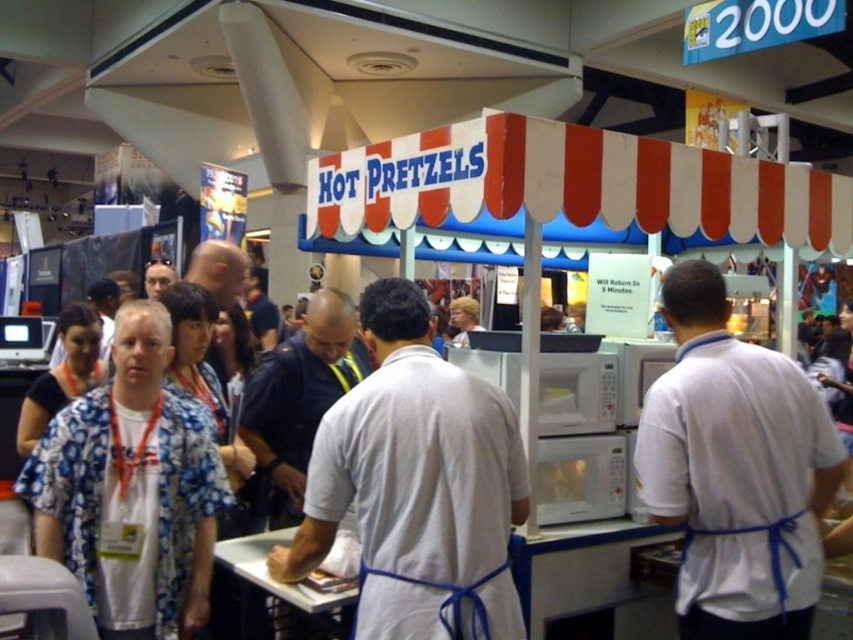
You are a visitor at the convention and want to ask the staff about the pretzel flavors. Which staff member should you approach, the one wearing the white matte shirt at center or the dark blue uniform at center, based on their position relative to each other?

You should approach the dark blue uniform at center because the white matte shirt at center is to the right of it, meaning the dark blue uniform at center is positioned to the left and likely closer to the stall where the pretzels are prepared.